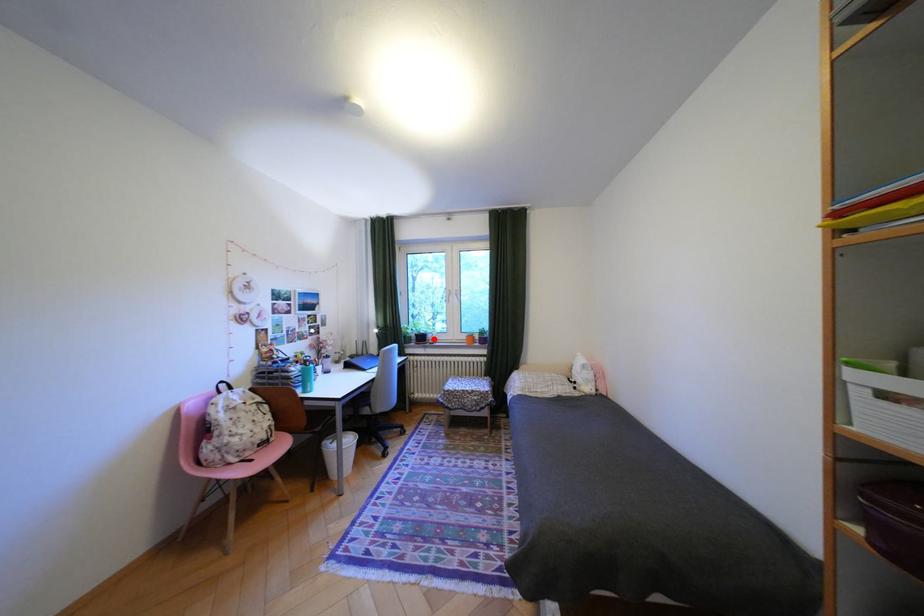
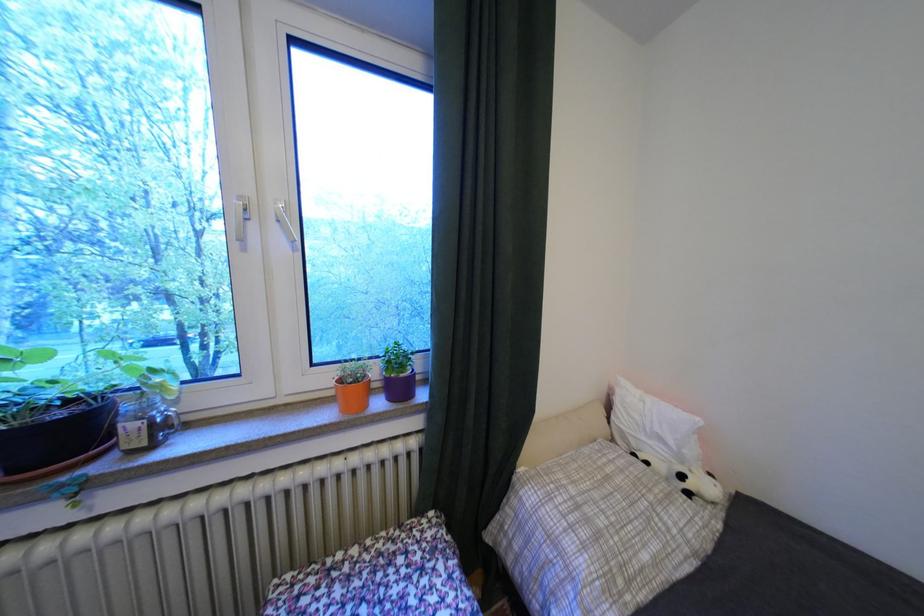
Question: I am providing you with two images of the same scene from different viewpoints. Given a red point in image1, look at the same physical point in image2. Is it:

Choices:
 (A) Closer to the viewpoint
 (B) Farther from the viewpoint

Answer: (A)